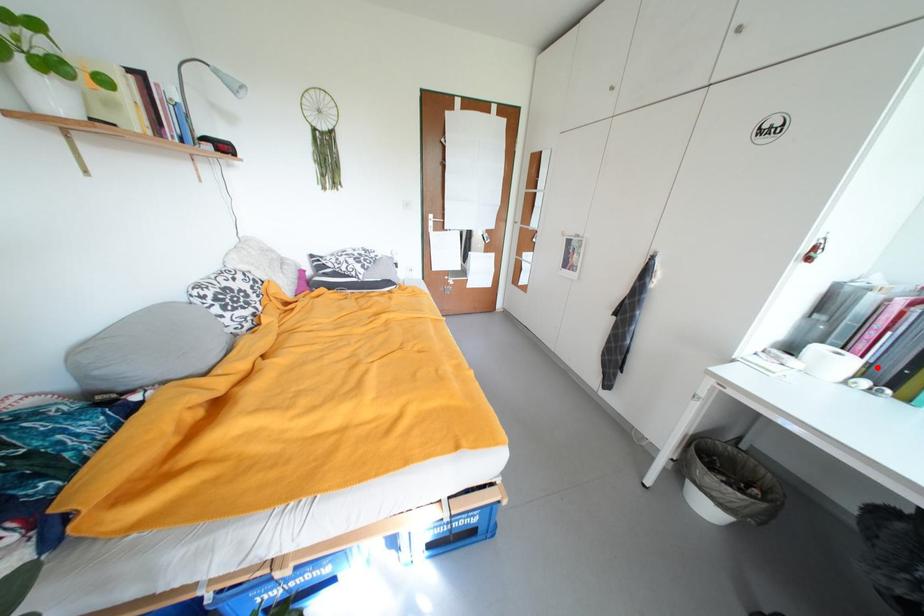
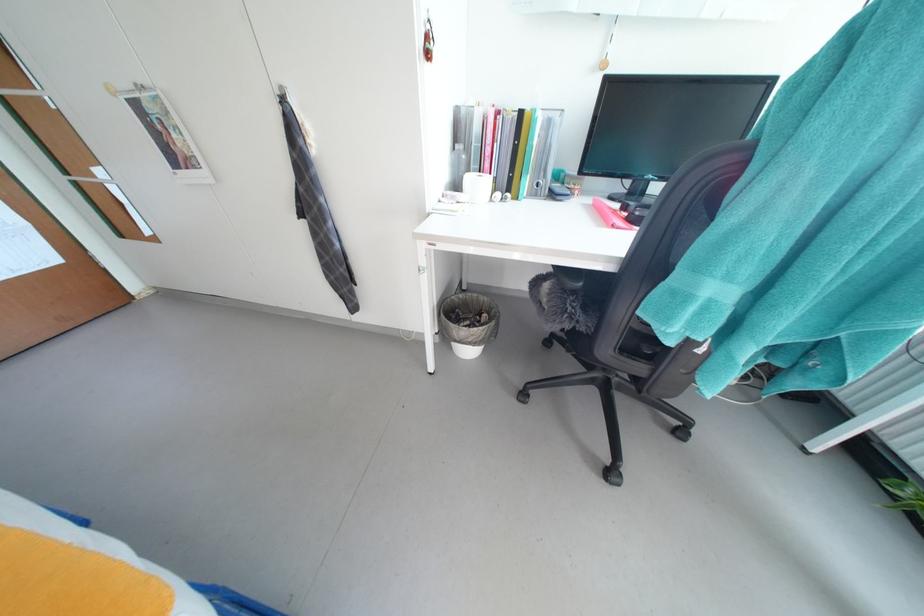
Question: I am providing you with two images of the same scene from different viewpoints. Image1 has a red point marked. In image2, the corresponding 3D location appears at what relative position? Reply with the corresponding letter.

Choices:
 (A) Closer
 (B) Farther

Answer: (A)